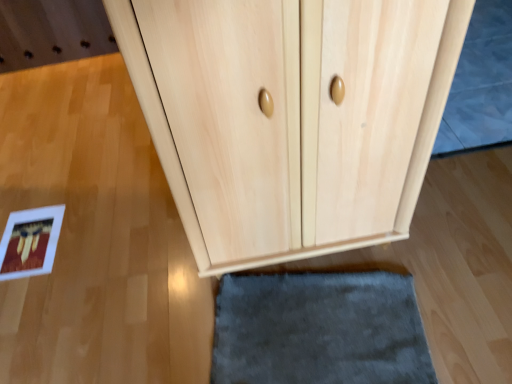
You are a GUI agent. You are given a task and a screenshot of the screen. Output one action in this format:
    pyautogui.click(x=<x>, y=<y>)
    Task: Click on the natural wood cupboard at center
    
    Given the screenshot: What is the action you would take?
    pyautogui.click(x=291, y=117)

In order to click on light wood door at center in this screenshot , I will do `click(320, 328)`.

At what (x,y) coordinates should I click in order to perform the action: click on bath mat behind the light wood door at center. Please return your answer as a coordinate pair (x, y). Looking at the image, I should click on (480, 84).

From a real-world perspective, is gray soft rug at upper right located higher than light wood door at center?

Actually, gray soft rug at upper right is physically below light wood door at center in the real world.

From the picture: Is gray soft rug at upper right taller than light wood door at center?

No.

Which object is closer to the camera taking this photo, gray soft rug at upper right or light wood door at center?

Positioned in front is light wood door at center.

From the image's perspective, is light wood door at center below gray soft rug at upper right?

Yes, from the image's perspective, light wood door at center is beneath gray soft rug at upper right.

Who is more distant, light wood door at center or gray soft rug at upper right?

gray soft rug at upper right is more distant.

Is light wood door at center bigger than gray soft rug at upper right?

Actually, light wood door at center might be smaller than gray soft rug at upper right.

Between natural wood cupboard at center and gray soft rug at upper right, which one has smaller width?

natural wood cupboard at center.

Is natural wood cupboard at center at the left side of gray soft rug at upper right?

Correct, you'll find natural wood cupboard at center to the left of gray soft rug at upper right.

Is natural wood cupboard at center smaller than gray soft rug at upper right?

No, natural wood cupboard at center is not smaller than gray soft rug at upper right.

Is natural wood cupboard at center looking in the opposite direction of gray soft rug at upper right?

That's not correct — natural wood cupboard at center is not looking away from gray soft rug at upper right.

Is light wood door at center further to the viewer compared to natural wood cupboard at center?

Yes, light wood door at center is behind natural wood cupboard at center.

From the image's perspective, is light wood door at center beneath natural wood cupboard at center?

Yes, from the image's perspective, light wood door at center is beneath natural wood cupboard at center.

Measure the distance from light wood door at center to natural wood cupboard at center.

They are 14.11 inches apart.

Who is shorter, light wood door at center or natural wood cupboard at center?

With less height is light wood door at center.

Is natural wood cupboard at center directly adjacent to light wood door at center?

No, natural wood cupboard at center is not in contact with light wood door at center.

At what (x,y) coordinates should I click in order to perform the action: click on cupboard that is in front of the light wood door at center. Please return your answer as a coordinate pair (x, y). The image size is (512, 384). Looking at the image, I should click on (291, 117).

Is point (380, 127) more distant than point (241, 375)?

No, (380, 127) is closer to viewer.

Could you tell me if gray soft rug at upper right is facing natural wood cupboard at center?

No, gray soft rug at upper right does not turn towards natural wood cupboard at center.

From the image's perspective, is gray soft rug at upper right beneath natural wood cupboard at center?

No, from the image's perspective, gray soft rug at upper right is not below natural wood cupboard at center.

Which of these two, gray soft rug at upper right or natural wood cupboard at center, is thinner?

With smaller width is natural wood cupboard at center.

Locate an element on the screen. The height and width of the screenshot is (384, 512). door that appears on the left of gray soft rug at upper right is located at coordinates (320, 328).

Locate an element on the screen. bath mat below the light wood door at center (from a real-world perspective) is located at coordinates (480, 84).

Considering their positions, is gray soft rug at upper right positioned closer to light wood door at center than natural wood cupboard at center?

natural wood cupboard at center is closer to light wood door at center.

Looking at the image, which one is located further to gray soft rug at upper right, light wood door at center or natural wood cupboard at center?

The object further to gray soft rug at upper right is light wood door at center.

Based on their spatial positions, is light wood door at center or gray soft rug at upper right further from natural wood cupboard at center?

gray soft rug at upper right is positioned further to the anchor natural wood cupboard at center.

When comparing their distances from gray soft rug at upper right, does natural wood cupboard at center or light wood door at center seem closer?

natural wood cupboard at center is closer to gray soft rug at upper right.

From the picture: Looking at the image, which one is located further to natural wood cupboard at center, gray soft rug at upper right or light wood door at center?

Among the two, gray soft rug at upper right is located further to natural wood cupboard at center.

When comparing their distances from light wood door at center, does natural wood cupboard at center or gray soft rug at upper right seem closer?

natural wood cupboard at center.

You are a GUI agent. You are given a task and a screenshot of the screen. Output one action in this format:
    pyautogui.click(x=<x>, y=<y>)
    Task: Click on the door situated between natural wood cupboard at center and gray soft rug at upper right from left to right
    This screenshot has height=384, width=512.
    Given the screenshot: What is the action you would take?
    click(320, 328)